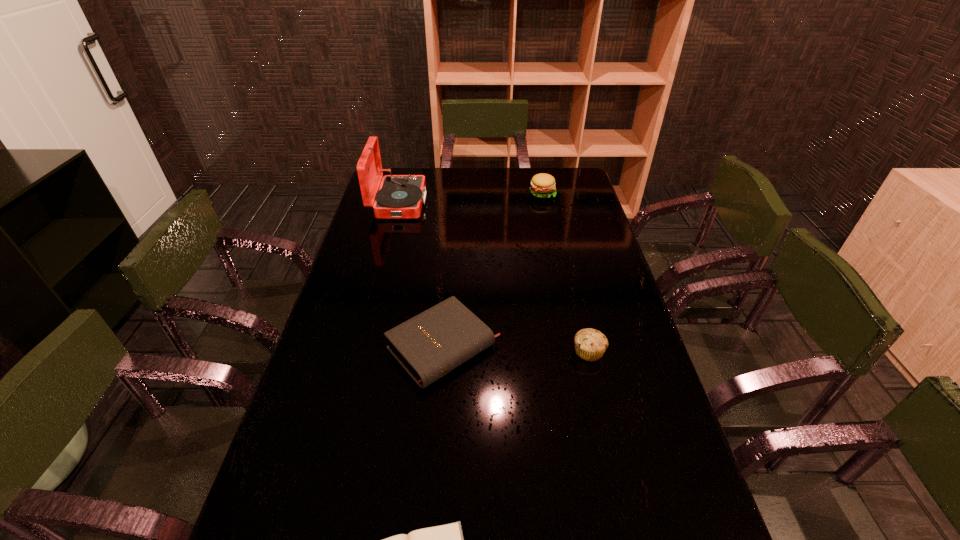
You are a GUI agent. You are given a task and a screenshot of the screen. Output one action in this format:
    pyautogui.click(x=<x>, y=<y>)
    Task: Click on the empty space between the muffin and the tallest object
    
    Given the screenshot: What is the action you would take?
    pyautogui.click(x=493, y=277)

Where is `free spot between the muffin and the tallest object`? This screenshot has width=960, height=540. free spot between the muffin and the tallest object is located at coordinates 493,277.

Image resolution: width=960 pixels, height=540 pixels. Find the location of `vacant area that lies between the phonograph_record and the hamburger`. vacant area that lies between the phonograph_record and the hamburger is located at coordinates (470, 198).

At what (x,y) coordinates should I click in order to perform the action: click on empty space that is in between the tallest object and the muffin. Please return your answer as a coordinate pair (x, y). The width and height of the screenshot is (960, 540). Looking at the image, I should click on (493, 277).

You are a GUI agent. You are given a task and a screenshot of the screen. Output one action in this format:
    pyautogui.click(x=<x>, y=<y>)
    Task: Click on the unoccupied area between the second shortest object and the tallest object
    The height and width of the screenshot is (540, 960).
    Given the screenshot: What is the action you would take?
    pyautogui.click(x=421, y=275)

At what (x,y) coordinates should I click in order to perform the action: click on object that stands as the closest to the hamburger. Please return your answer as a coordinate pair (x, y). Looking at the image, I should click on (400, 196).

Point out which object is positioned as the third nearest to the hamburger. Please provide its 2D coordinates. Your answer should be formatted as a tuple, i.e. [(x, y)], where the tuple contains the x and y coordinates of a point satisfying the conditions above.

[(590, 344)]

I want to click on vacant space that satisfies the following two spatial constraints: 1. on the back side of the taller Bible; 2. on the front-facing side of the tallest object, so click(x=455, y=203).

Where is `vacant space that satisfies the following two spatial constraints: 1. on the front side of the taller Bible; 2. on the right side of the muffin`? The height and width of the screenshot is (540, 960). vacant space that satisfies the following two spatial constraints: 1. on the front side of the taller Bible; 2. on the right side of the muffin is located at coordinates (444, 352).

Where is `free space that satisfies the following two spatial constraints: 1. on the front-facing side of the tallest object; 2. on the right side of the farther Bible`? free space that satisfies the following two spatial constraints: 1. on the front-facing side of the tallest object; 2. on the right side of the farther Bible is located at coordinates (361, 348).